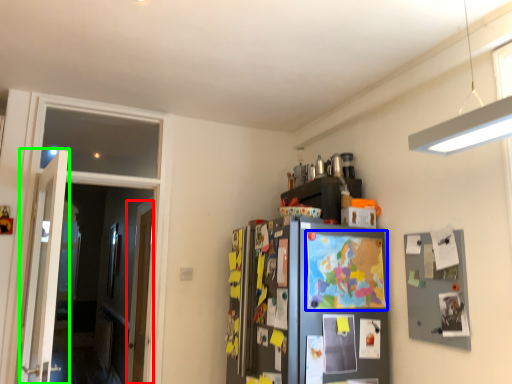
Question: Based on their relative distances, which object is farther from door (highlighted by a red box)? Choose from map (highlighted by a blue box) and door (highlighted by a green box).

Choices:
 (A) map
 (B) door

Answer: (A)